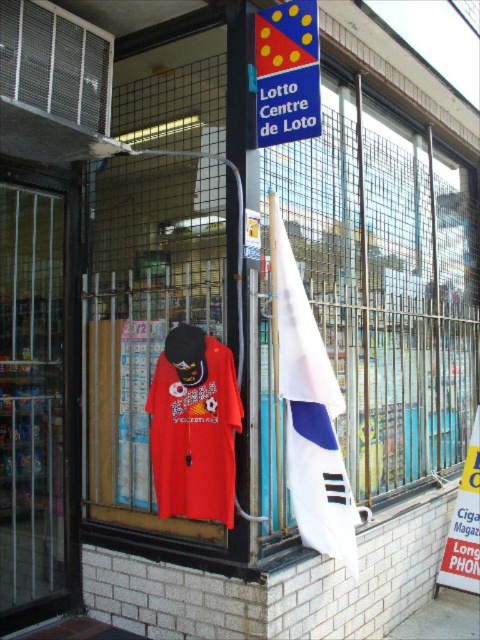
You are standing in front of the Lotto Centre de Loto store. There are two points marked on the security gate. The first point is at coordinates point (60, 212) and the second point is at point (285, 17). Which point is closer to you?

Point (60, 212) is further to the camera than point (285, 17), so the point closer to you is point (285, 17).

You are standing in front of the Lotto Centre de Loto store and see two points marked on the security gate. The first point is at coordinates point (x=301, y=449) and the second is at point (x=316, y=93). Which point is closer to you?

Point (x=316, y=93) is closer to you because it is less further to the camera than point (x=301, y=449).

You are a customer approaching the Lotto Centre de Loto and want to enter the store. The entrance has a transparent glass door at left and a blue plastic sign at upper center. Which object should you interact with first to enter the store?

You should interact with the transparent glass door at left first to enter the store, as it is the entrance. The blue plastic sign at upper center is likely just a sign and not an entry point.